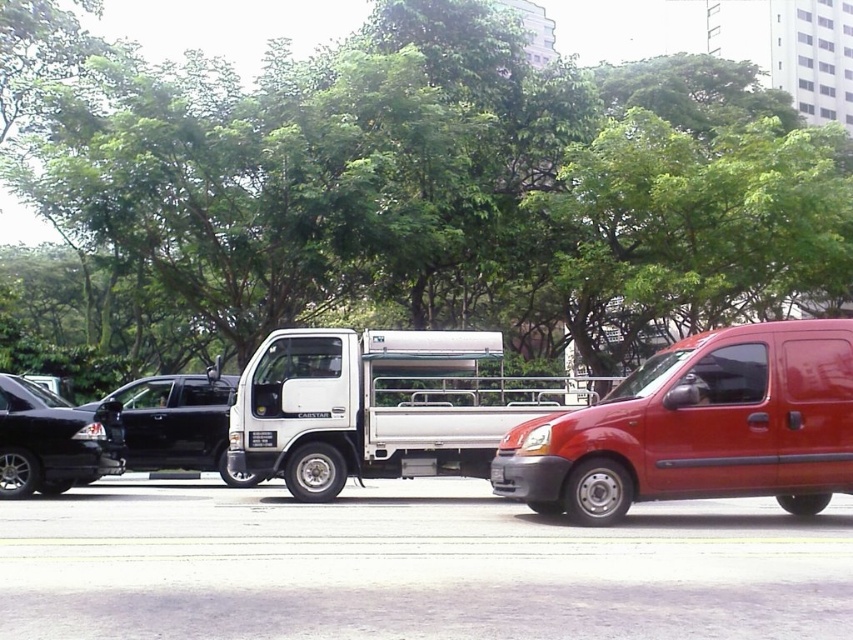
You are a pedestrian standing on the sidewalk and want to cross the street. The green leafy tree at upper center and the shiny black sedan at left are in your line of sight. Which object is taller, and how does this affect your visibility when crossing?

The green leafy tree at upper center is much taller than the shiny black sedan at left. This means the tree could potentially block your view of oncoming traffic when crossing the street, so you should be cautious and check carefully before proceeding.